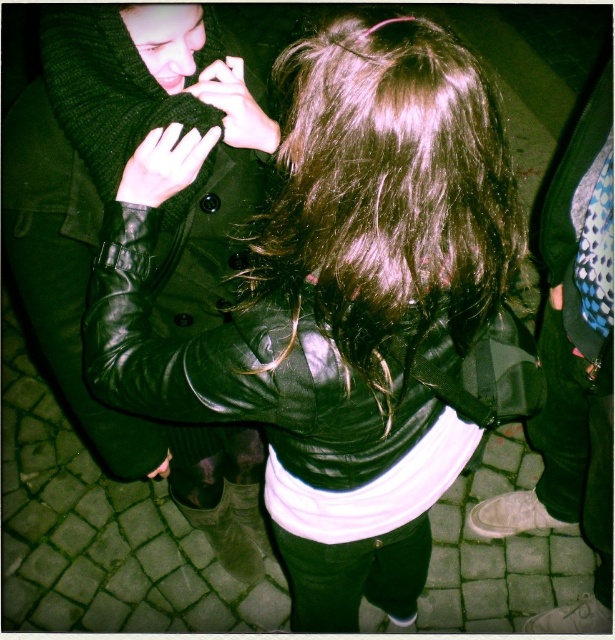
You are standing at the point marked as point (347, 310) in the image. Looking around, you see the leather jacket at center. What is the nearest object to you?

The nearest object to you at point (347, 310) is the leather jacket at center.

You are a photographer trying to capture a closeup of the shiny black leather jacket at center and the matte black hand at center. Which object should you focus on first if you want to ensure both are in focus without moving the camera?

The shiny black leather jacket at center is to the left of matte black hand at center. Since the hand is closer to the camera, focusing on the hand first will ensure both are in focus due to the depth of field overlapping.

You are a photographer setting up for a night shoot. You have two subjects in frame. One has a leather jacket at center and the other has shiny brown hair at center. Based on their positions, which subject is closer to the left side of the frame?

The leather jacket at center is to the left of shiny brown hair at center, so the subject wearing the leather jacket at center is closer to the left side of the frame.